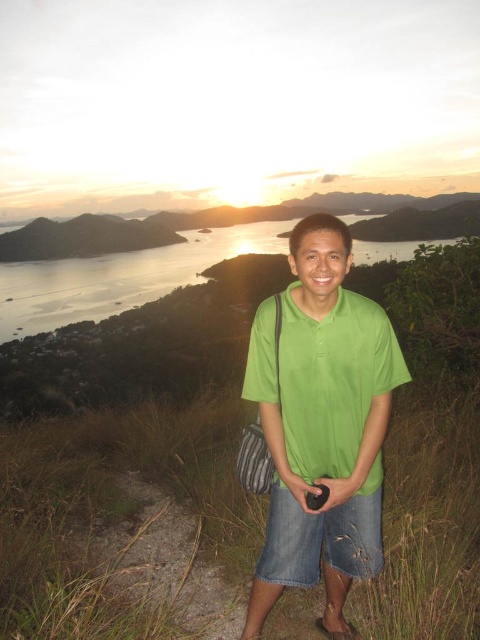
Is green cotton shirt at center smaller than denim shorts at lower center?

Actually, green cotton shirt at center might be larger than denim shorts at lower center.

Who is more distant from viewer, (323,452) or (325,522)?

Positioned behind is point (325,522).

Is point (264, 413) farther from camera compared to point (344, 564)?

No, it is in front of (344, 564).

Where is `green cotton shirt at center`? The image size is (480, 640). green cotton shirt at center is located at coordinates (322, 426).